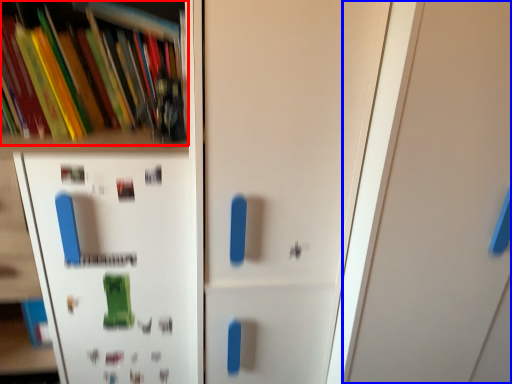
Question: Which of the following is the closest to the observer, book (highlighted by a red box) or door (highlighted by a blue box)?

Choices:
 (A) book
 (B) door

Answer: (B)